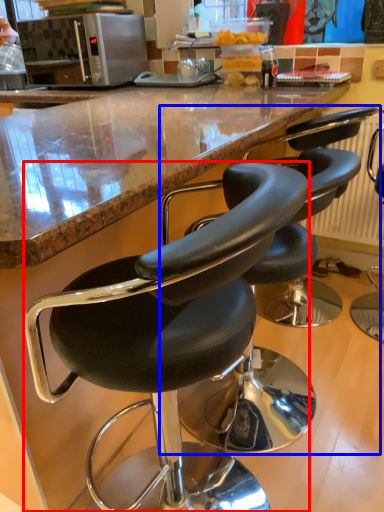
Question: Which object appears farthest to the camera in this image, chair (highlighted by a red box) or chair (highlighted by a blue box)?

Choices:
 (A) chair
 (B) chair

Answer: (B)